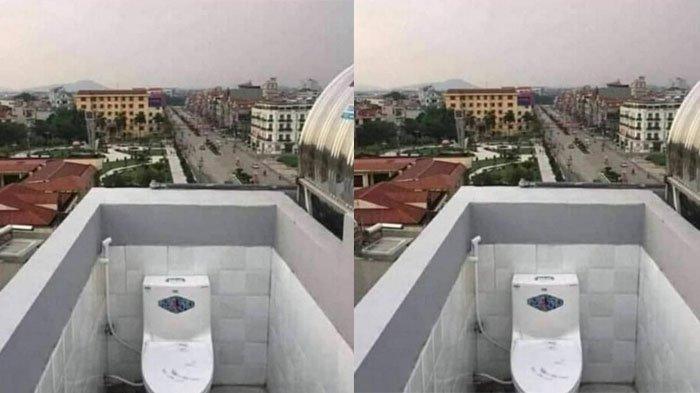
Find the location of a particular element. This screenshot has height=393, width=700. toilet is located at coordinates (171, 370), (542, 363).